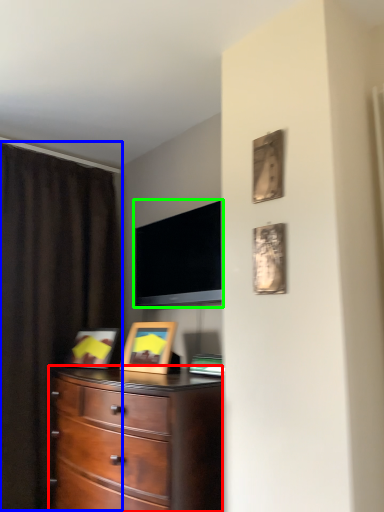
Question: Which object is positioned farthest from chest of drawers (highlighted by a red box)? Select from curtain (highlighted by a blue box) and television (highlighted by a green box).

Choices:
 (A) curtain
 (B) television

Answer: (A)